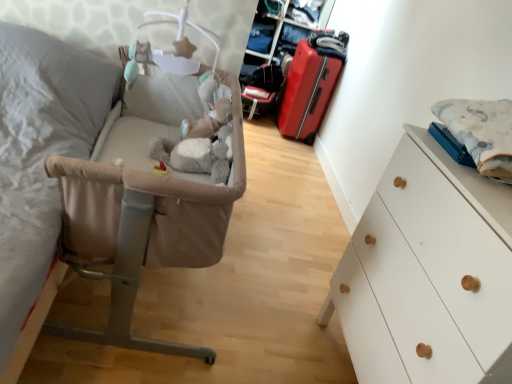
Question: Is fluffy white blanket at right in front of or behind beige fabric infant bed at left in the image?

Choices:
 (A) front
 (B) behind

Answer: (B)

Question: Based on their positions, is fluffy white blanket at right located to the left or right of beige fabric infant bed at left?

Choices:
 (A) right
 (B) left

Answer: (A)

Question: Considering the real-world distances, which object is farthest from the beige fabric infant bed at left?

Choices:
 (A) white matte chest of drawers at right
 (B) matte red suitcase at center-right
 (C) fluffy white blanket at right

Answer: (B)

Question: Which object is positioned closest to the fluffy white blanket at right?

Choices:
 (A) beige fabric infant bed at left
 (B) white matte chest of drawers at right
 (C) matte red suitcase at center-right

Answer: (B)